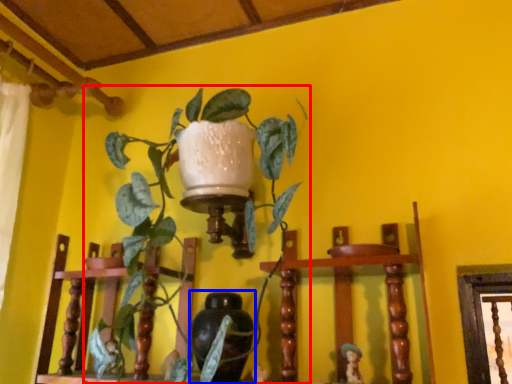
Question: Which object appears closest to the camera in this image, houseplant (highlighted by a red box) or vase (highlighted by a blue box)?

Choices:
 (A) houseplant
 (B) vase

Answer: (A)